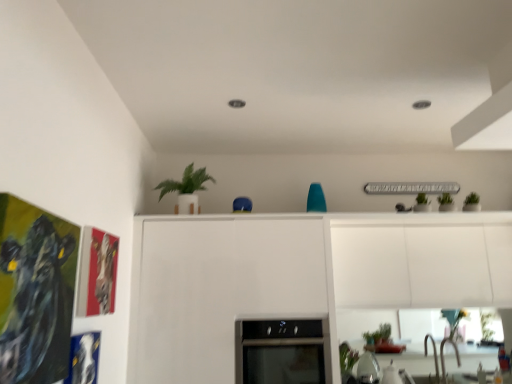
Question: From the image's perspective, is metallic silver faucet at lower right on green matte plant at lower center?

Choices:
 (A) no
 (B) yes

Answer: (A)

Question: Is metallic silver faucet at lower right closer to the viewer compared to green matte plant at lower center?

Choices:
 (A) yes
 (B) no

Answer: (A)

Question: From a real-world perspective, is metallic silver faucet at lower right on green matte plant at lower center?

Choices:
 (A) no
 (B) yes

Answer: (A)

Question: From a real-world perspective, is metallic silver faucet at lower right physically below green matte plant at lower center?

Choices:
 (A) no
 (B) yes

Answer: (B)

Question: Is metallic silver faucet at lower right at the left side of green matte plant at lower center?

Choices:
 (A) no
 (B) yes

Answer: (A)

Question: In terms of size, does black glass oven at center appear bigger or smaller than green matte plant at upper center?

Choices:
 (A) small
 (B) big

Answer: (B)

Question: Is point (309, 369) closer or farther from the camera than point (185, 211)?

Choices:
 (A) closer
 (B) farther

Answer: (A)

Question: Is black glass oven at center inside or outside of green matte plant at upper center?

Choices:
 (A) outside
 (B) inside

Answer: (A)

Question: From a real-world perspective, relative to green matte plant at upper center, is black glass oven at center vertically above or below?

Choices:
 (A) below
 (B) above

Answer: (A)

Question: From the image's perspective, is metallic silver faucet at lower right located above or below green matte plant at upper center?

Choices:
 (A) below
 (B) above

Answer: (A)

Question: Is metallic silver faucet at lower right to the left or to the right of green matte plant at upper center in the image?

Choices:
 (A) right
 (B) left

Answer: (A)

Question: Does point (449, 339) appear closer or farther from the camera than point (187, 168)?

Choices:
 (A) farther
 (B) closer

Answer: (A)

Question: Is metallic silver faucet at lower right inside the boundaries of green matte plant at upper center, or outside?

Choices:
 (A) outside
 (B) inside

Answer: (A)

Question: Considering the positions of black glass oven at center and green matte plant at lower center in the image, is black glass oven at center taller or shorter than green matte plant at lower center?

Choices:
 (A) short
 (B) tall

Answer: (B)

Question: From a real-world perspective, relative to green matte plant at lower center, is black glass oven at center vertically above or below?

Choices:
 (A) above
 (B) below

Answer: (A)